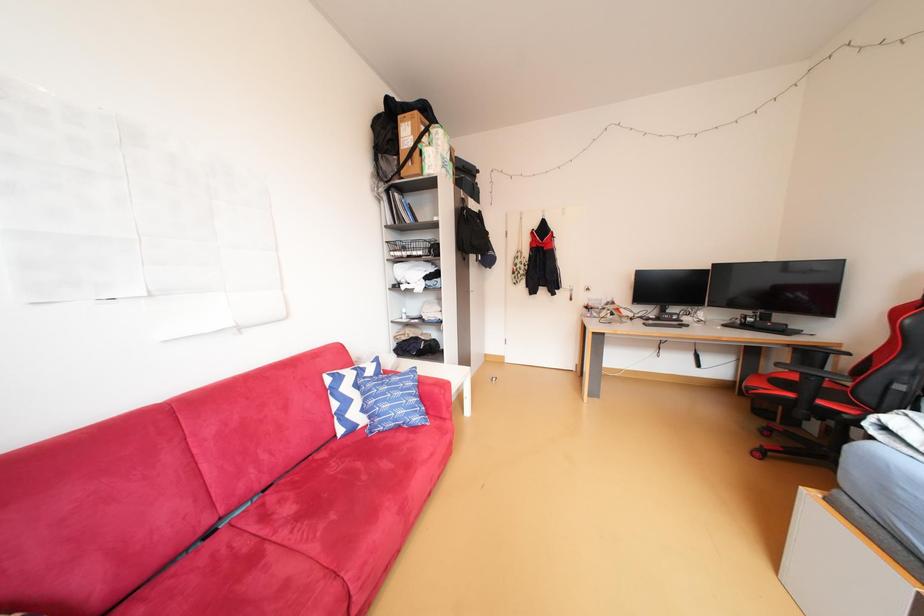
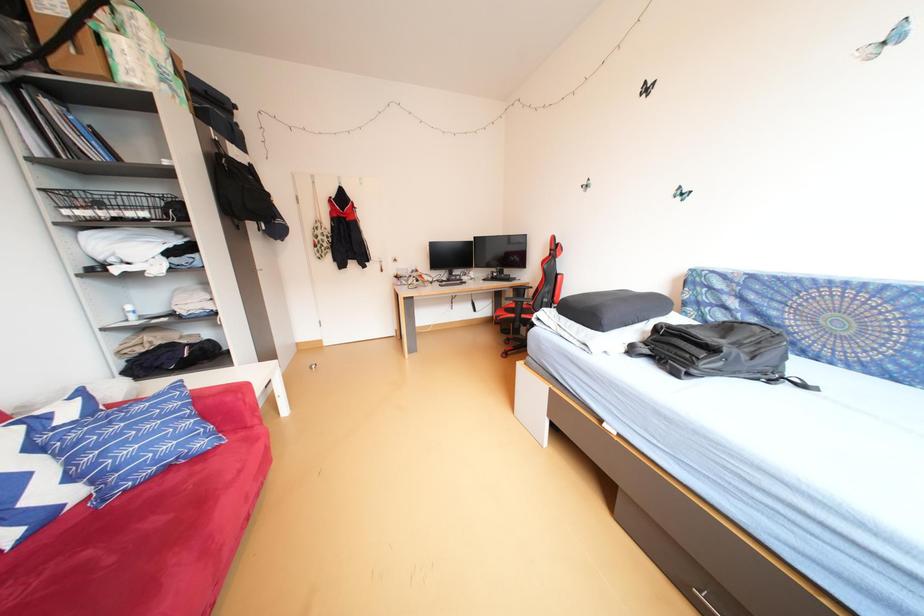
Question: The first image is from the beginning of the video and the second image is from the end. How did the camera likely rotate when shooting the video?

Choices:
 (A) Left
 (B) Right
 (C) Up
 (D) Down

Answer: (B)